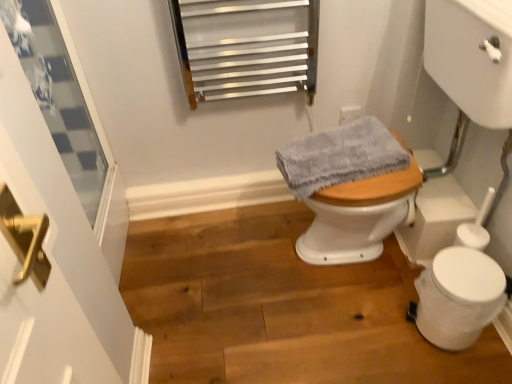
Where is `wooden floor at center`? Image resolution: width=512 pixels, height=384 pixels. wooden floor at center is located at coordinates (281, 307).

You are a GUI agent. You are given a task and a screenshot of the screen. Output one action in this format:
    pyautogui.click(x=<x>, y=<y>)
    Task: Click on the white plastic toilet bowl at lower right
    
    Given the screenshot: What is the action you would take?
    pyautogui.click(x=458, y=297)

Measure the distance between white plastic toilet bowl at lower right and camera.

They are 1.22 meters apart.

Where is `clear glass window at upper left`? clear glass window at upper left is located at coordinates (58, 95).

Consider the image. From the image's perspective, does wooden floor at center appear higher than clear glass window at upper left?

No, from the image's perspective, wooden floor at center is not above clear glass window at upper left.

Where is `window above the wooden floor at center (from the image's perspective)`? window above the wooden floor at center (from the image's perspective) is located at coordinates (58, 95).

Looking at this image, between wooden floor at center and clear glass window at upper left, which one has larger width?

wooden floor at center is wider.

Between wooden floor at center and clear glass window at upper left, which one has smaller size?

Smaller between the two is clear glass window at upper left.

Considering the sizes of wooden floor at center and gray fabric at center in the image, is wooden floor at center wider or thinner than gray fabric at center?

Considering their sizes, wooden floor at center looks broader than gray fabric at center.

Is point (412, 361) positioned after point (349, 199)?

Yes, it is.

In the scene shown: Is wooden floor at center oriented away from gray fabric at center?

No.

How many degrees apart are the facing directions of wooden floor at center and gray fabric at center?

The angular difference between wooden floor at center and gray fabric at center is 83 degrees.

Which object is closer to the camera taking this photo, white plastic toilet bowl at lower right or clear glass window at upper left?

Positioned in front is clear glass window at upper left.

Which of these two, white plastic toilet bowl at lower right or clear glass window at upper left, is bigger?

With larger size is clear glass window at upper left.

From the image's perspective, is white plastic toilet bowl at lower right above clear glass window at upper left?

No.

Is white plastic toilet bowl at lower right outside of clear glass window at upper left?

Indeed, white plastic toilet bowl at lower right is completely outside clear glass window at upper left.

Relative to wooden floor at center, is clear glass window at upper left in front or behind?

In the image, clear glass window at upper left appears in front of wooden floor at center.

Is clear glass window at upper left wider or thinner than wooden floor at center?

clear glass window at upper left is thinner than wooden floor at center.

Considering the positions of objects clear glass window at upper left and wooden floor at center in the image provided, who is more to the right, clear glass window at upper left or wooden floor at center?

Positioned to the right is wooden floor at center.

Is clear glass window at upper left beside wooden floor at center?

No, clear glass window at upper left is not beside wooden floor at center.

In the scene shown: Considering the sizes of objects white glossy sink at right and clear glass window at upper left in the image provided, who is thinner, white glossy sink at right or clear glass window at upper left?

clear glass window at upper left is thinner.

In the scene shown: Is white glossy sink at right facing away from clear glass window at upper left?

No, white glossy sink at right is not facing away from clear glass window at upper left.

Relative to clear glass window at upper left, is white glossy sink at right in front or behind?

Visually, white glossy sink at right is located in front of clear glass window at upper left.

From the image's perspective, relative to clear glass window at upper left, is white glossy sink at right above or below?

Based on their image positions, white glossy sink at right is located beneath clear glass window at upper left.

Consider the image. Considering the positions of objects white glossy sink at right and wooden floor at center in the image provided, who is more to the right, white glossy sink at right or wooden floor at center?

white glossy sink at right.

Is white glossy sink at right positioned far away from wooden floor at center?

That's not correct — white glossy sink at right is a little close to wooden floor at center.

From the image's perspective, does white glossy sink at right appear lower than wooden floor at center?

No, from the image's perspective, white glossy sink at right is not beneath wooden floor at center.

Is white glossy sink at right aimed at wooden floor at center?

Yes, white glossy sink at right faces towards wooden floor at center.

Based on the photo, is the depth of white plastic toilet bowl at lower right greater than that of gray fabric at center?

No.

From a real-world perspective, which is physically above, white plastic toilet bowl at lower right or gray fabric at center?

gray fabric at center, from a real-world perspective.

The image size is (512, 384). In order to click on toilet above the white plastic toilet bowl at lower right (from the image's perspective) in this screenshot , I will do `click(350, 190)`.

Considering the sizes of white plastic toilet bowl at lower right and gray fabric at center in the image, is white plastic toilet bowl at lower right taller or shorter than gray fabric at center?

In the image, white plastic toilet bowl at lower right appears to be taller than gray fabric at center.

This screenshot has width=512, height=384. What are the coordinates of `stairwell below the clear glass window at upper left (from a real-world perspective)` in the screenshot? It's located at (281, 307).

Locate an element on the screen. This screenshot has width=512, height=384. toilet that is above the wooden floor at center (from the image's perspective) is located at coordinates (350, 190).

Estimate the real-world distances between objects in this image. Which object is further from gray fabric at center, white glossy sink at right or white plastic toilet bowl at lower right?

white plastic toilet bowl at lower right.

Based on their spatial positions, is white glossy sink at right or wooden floor at center closer to white plastic toilet bowl at lower right?

white glossy sink at right is positioned closer to the anchor white plastic toilet bowl at lower right.

Estimate the real-world distances between objects in this image. Which object is closer to wooden floor at center, white plastic toilet bowl at lower right or clear glass window at upper left?

white plastic toilet bowl at lower right lies closer to wooden floor at center than the other object.

Looking at the image, which one is located closer to white glossy sink at right, clear glass window at upper left or gray fabric at center?

gray fabric at center is positioned closer to the anchor white glossy sink at right.

Which object lies nearer to the anchor point gray fabric at center, clear glass window at upper left or white glossy sink at right?

white glossy sink at right is positioned closer to the anchor gray fabric at center.

Estimate the real-world distances between objects in this image. Which object is closer to clear glass window at upper left, white plastic toilet bowl at lower right or white glossy sink at right?

white glossy sink at right is closer to clear glass window at upper left.

Looking at the image, which one is located further to clear glass window at upper left, gray fabric at center or white glossy sink at right?

white glossy sink at right lies further to clear glass window at upper left than the other object.

Considering their positions, is clear glass window at upper left positioned closer to white plastic toilet bowl at lower right than white glossy sink at right?

white glossy sink at right lies closer to white plastic toilet bowl at lower right than the other object.

This screenshot has width=512, height=384. In order to click on stairwell between clear glass window at upper left and white plastic toilet bowl at lower right in the horizontal direction in this screenshot , I will do `click(281, 307)`.

At what (x,y) coordinates should I click in order to perform the action: click on toilet between clear glass window at upper left and white glossy sink at right. Please return your answer as a coordinate pair (x, y). This screenshot has height=384, width=512. Looking at the image, I should click on (350, 190).

In order to click on toilet that lies between white glossy sink at right and white plastic toilet bowl at lower right from top to bottom in this screenshot , I will do `click(350, 190)`.

The height and width of the screenshot is (384, 512). What are the coordinates of `toilet bowl between white glossy sink at right and wooden floor at center in the up-down direction` in the screenshot? It's located at (458, 297).